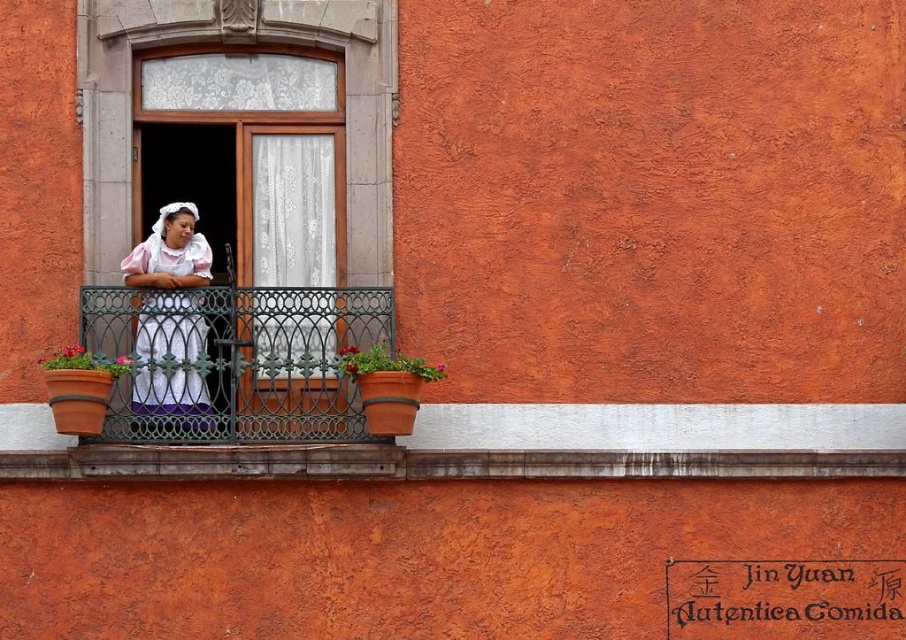
Question: Does green wrought iron balcony at center appear under white cotton dress at center?

Choices:
 (A) no
 (B) yes

Answer: (B)

Question: Can you confirm if smooth concrete ledge at center is smaller than terracotta clay pot at left?

Choices:
 (A) yes
 (B) no

Answer: (B)

Question: Which of these objects is positioned farthest from the terracotta clay pot at left?

Choices:
 (A) white cotton dress at center
 (B) green wrought iron balcony at center

Answer: (B)

Question: Which object is farther from the camera taking this photo?

Choices:
 (A) terracotta clay pot at left
 (B) wooden window frame at center
 (C) smooth concrete ledge at center

Answer: (B)

Question: Is wooden window frame at center smaller than terracotta clay pot at left?

Choices:
 (A) yes
 (B) no

Answer: (B)

Question: Which of these objects is positioned farthest from the white cotton dress at center?

Choices:
 (A) green wrought iron balcony at center
 (B) terracotta clay pot at left
 (C) wooden window frame at center

Answer: (A)